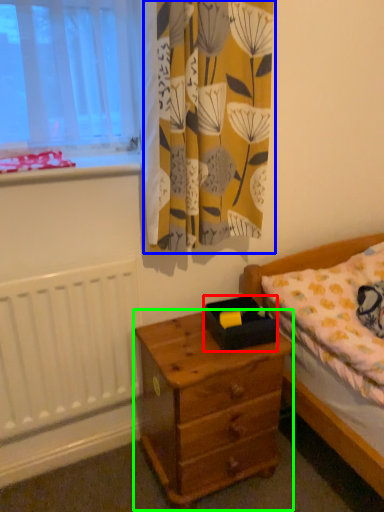
Question: Estimate the real-world distances between objects in this image. Which object is closer to box (highlighted by a red box), curtain (highlighted by a blue box) or nightstand (highlighted by a green box)?

Choices:
 (A) curtain
 (B) nightstand

Answer: (B)